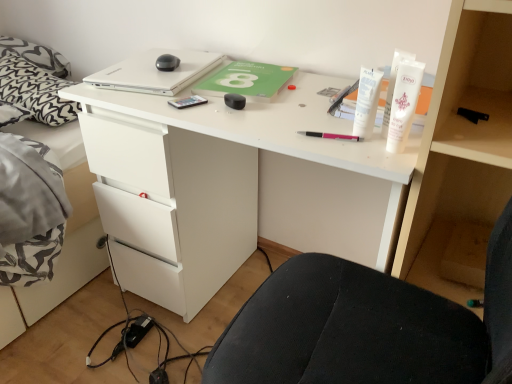
I want to click on free space to the back side of white matte tube at upper right, which is the first toiletry from right to left, so click(333, 117).